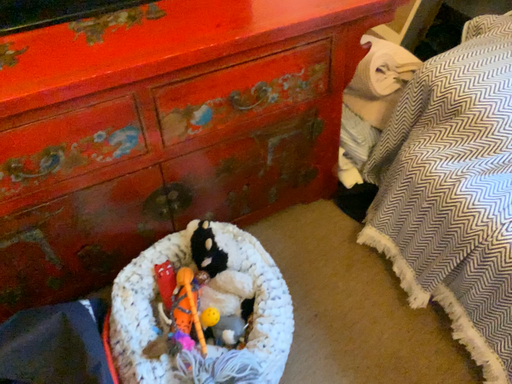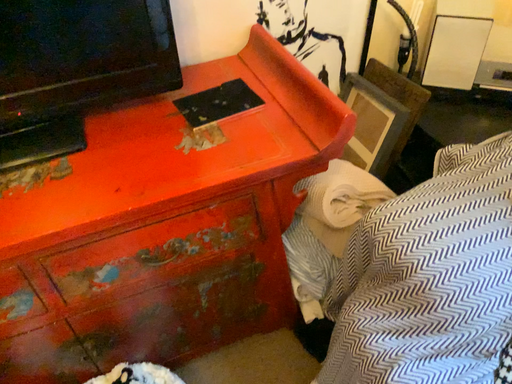
Question: How did the camera likely rotate when shooting the video?

Choices:
 (A) rotated right
 (B) rotated left

Answer: (B)